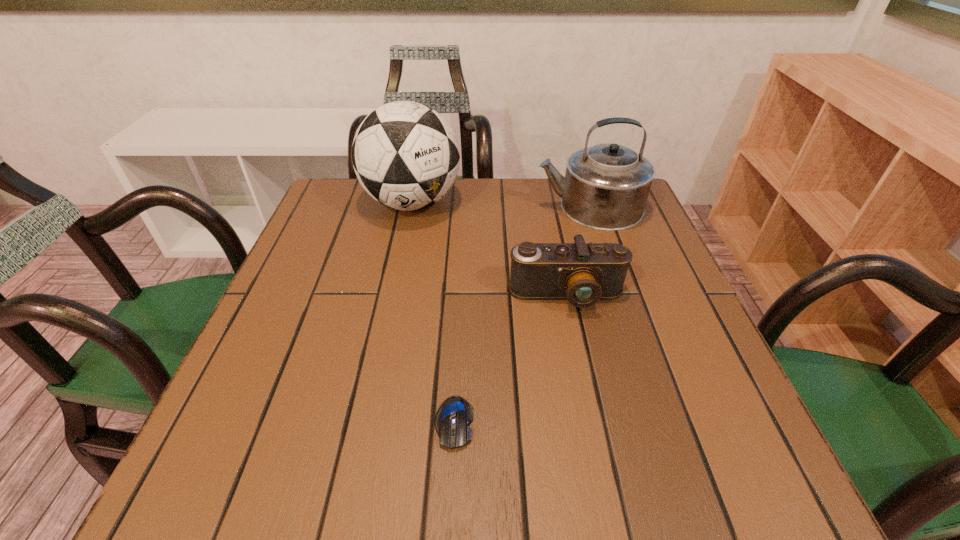
Find the location of a particular element. soccer ball is located at coordinates (406, 156).

What are the coordinates of `kettle` in the screenshot? It's located at (606, 187).

Where is `the second nearest object`? The height and width of the screenshot is (540, 960). the second nearest object is located at coordinates (583, 273).

Identify the location of the second shortest object. (583, 273).

Locate an element on the screen. the nearest object is located at coordinates (452, 420).

Identify the location of the shortest object. This screenshot has height=540, width=960. (452, 420).

This screenshot has height=540, width=960. In order to click on vacant region located on the surface of the soccer ball where the brand logo is visible in this screenshot , I will do `click(397, 274)`.

Image resolution: width=960 pixels, height=540 pixels. In order to click on vacant space located with the spout at the front of the kettle in this screenshot , I will do `click(492, 207)`.

Image resolution: width=960 pixels, height=540 pixels. I want to click on vacant region located 0.240m with the spout at the front of the kettle, so click(441, 207).

The image size is (960, 540). Find the location of `free point located with the spout at the front of the kettle`. free point located with the spout at the front of the kettle is located at coordinates (488, 207).